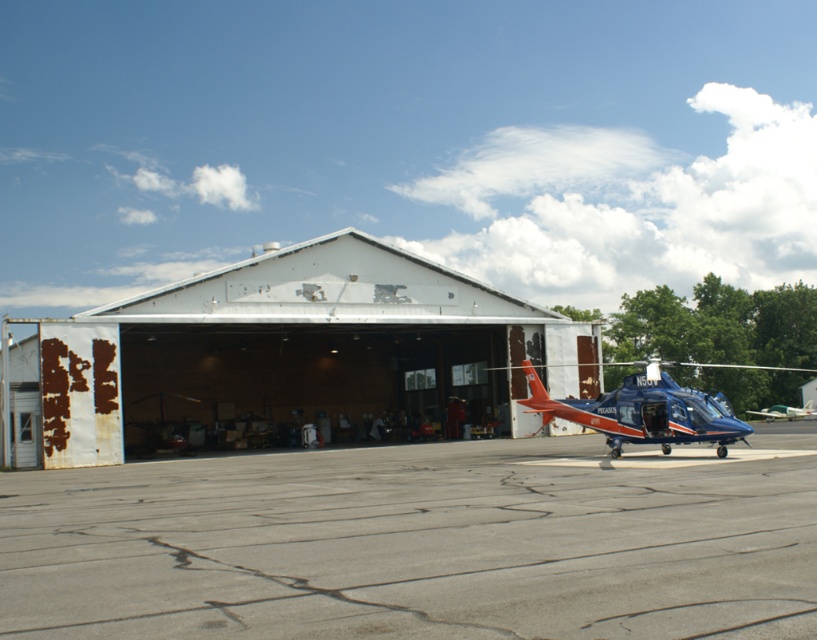
Looking at this image, who is shorter, gray concrete tarmac at center or white matte hangar at center?

gray concrete tarmac at center

Is point (378, 458) farther from camera compared to point (173, 368)?

No, (378, 458) is closer to viewer.

What are the coordinates of `gray concrete tarmac at center` in the screenshot? It's located at (420, 541).

Is white matte hangar at center bigger than blue metallic helicopter at center?

Correct, white matte hangar at center is larger in size than blue metallic helicopter at center.

The image size is (817, 640). What are the coordinates of `white matte hangar at center` in the screenshot? It's located at (289, 356).

Which is behind, point (99, 426) or point (659, 378)?

Positioned behind is point (99, 426).

Identify the location of white matte hangar at center. The image size is (817, 640). (289, 356).

Who is more distant from viewer, (319, 452) or (636, 394)?

The point (319, 452) is more distant.

Who is lower down, gray concrete tarmac at center or blue metallic helicopter at center?

gray concrete tarmac at center is lower down.

Find the location of a particular element. Image resolution: width=817 pixels, height=640 pixels. gray concrete tarmac at center is located at coordinates (420, 541).